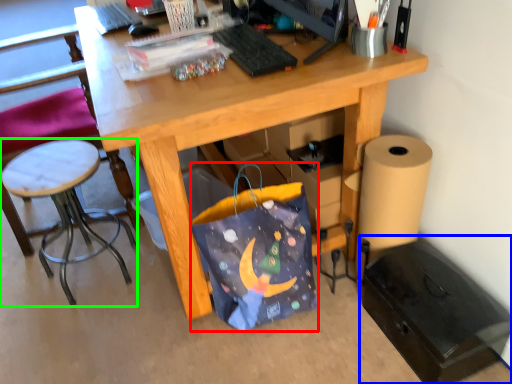
Question: Considering the real-world distances, which object is farthest from bag (highlighted by a red box)? file cabinet (highlighted by a blue box) or stool (highlighted by a green box)?

Choices:
 (A) file cabinet
 (B) stool

Answer: (B)